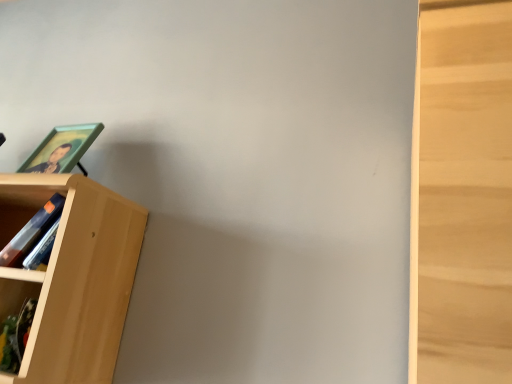
Question: Is light wood bookcase at left spatially inside matte green picture frame at left, or outside of it?

Choices:
 (A) inside
 (B) outside

Answer: (B)

Question: Looking at the image, does light wood bookcase at left seem bigger or smaller compared to matte green picture frame at left?

Choices:
 (A) big
 (B) small

Answer: (A)

Question: Does point (53, 248) appear closer or farther from the camera than point (31, 160)?

Choices:
 (A) closer
 (B) farther

Answer: (A)

Question: From the image's perspective, relative to light wood bookcase at left, is matte green picture frame at left above or below?

Choices:
 (A) below
 (B) above

Answer: (B)

Question: Does point (50, 165) appear closer or farther from the camera than point (110, 236)?

Choices:
 (A) closer
 (B) farther

Answer: (B)

Question: Is matte green picture frame at left in front of or behind light wood bookcase at left in the image?

Choices:
 (A) behind
 (B) front

Answer: (A)

Question: Visually, is matte green picture frame at left positioned to the left or to the right of light wood bookcase at left?

Choices:
 (A) right
 (B) left

Answer: (A)